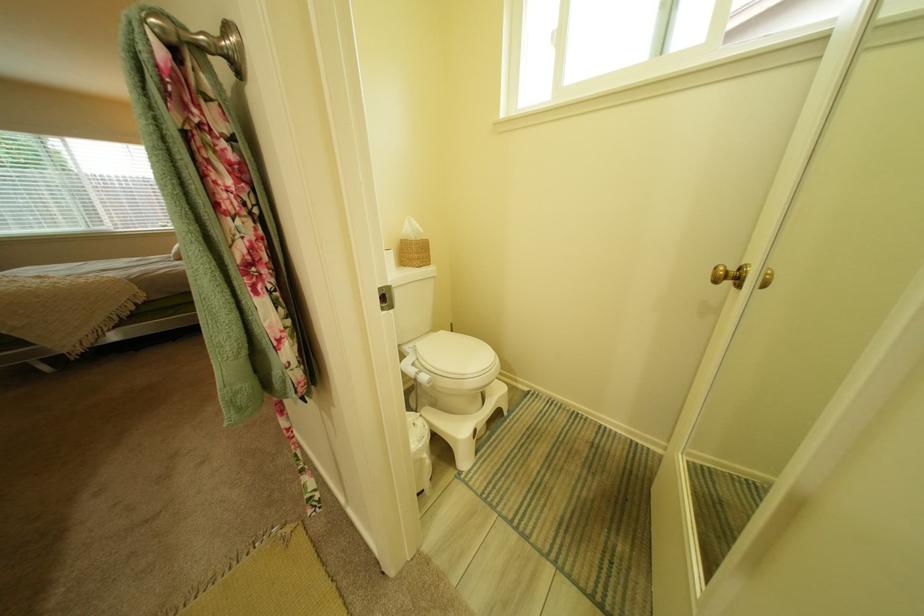
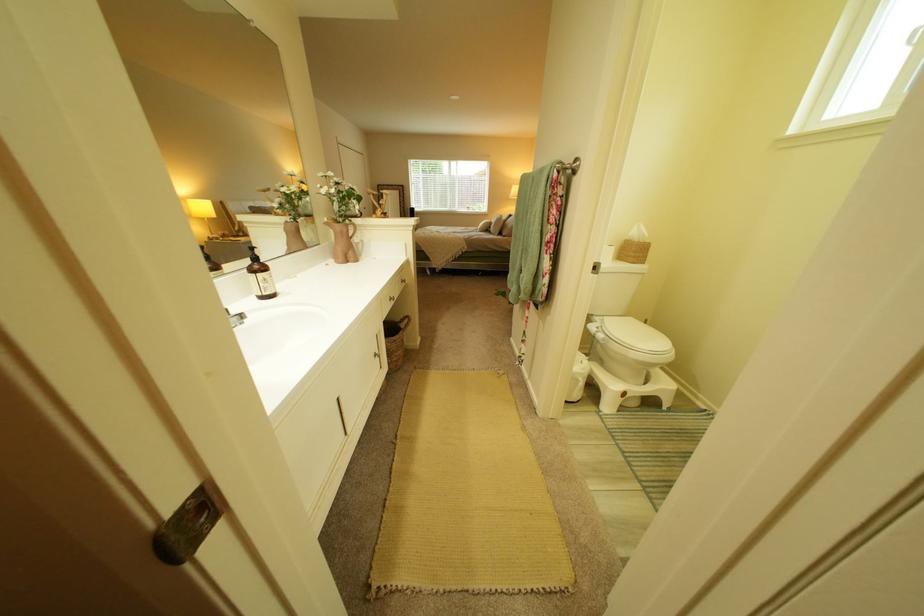
Question: The first image is from the beginning of the video and the second image is from the end. How did the camera likely rotate when shooting the video?

Choices:
 (A) Left
 (B) Right
 (C) Up
 (D) Down

Answer: (A)